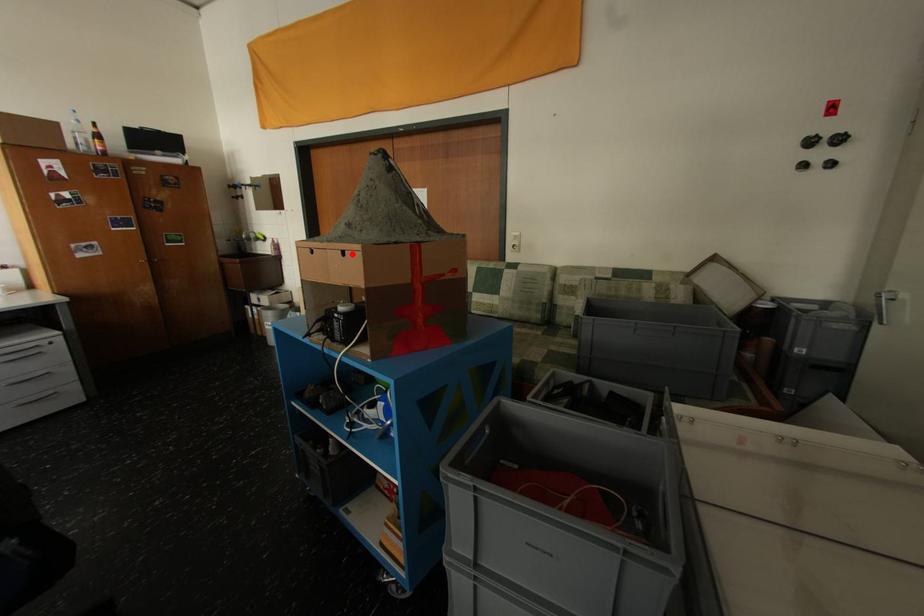
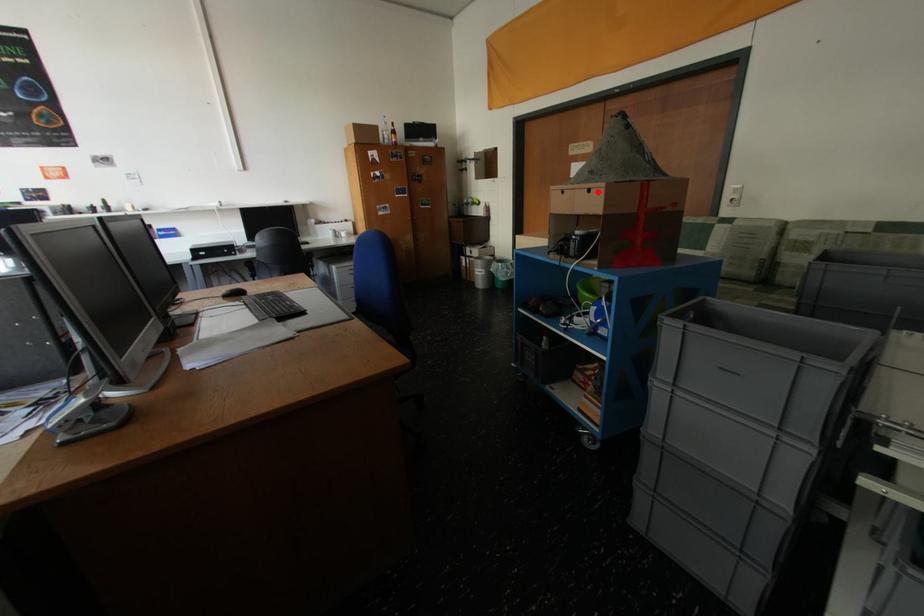
I am providing you with two images of the same scene from different viewpoints. A red point is marked on the first image and another point is marked on the second image. Is the red point in image1 aligned with the point shown in image2?

Yes